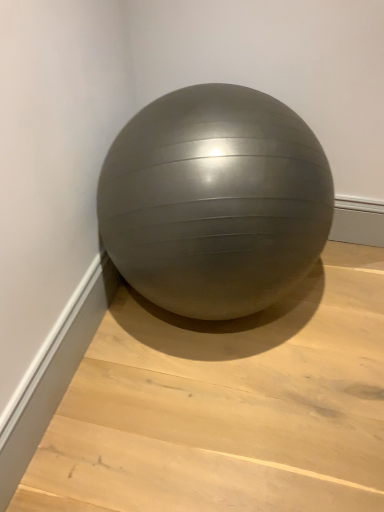
Find the location of a particular element. This screenshot has height=512, width=384. matte gray ball at center is located at coordinates 215,201.

This screenshot has height=512, width=384. What do you see at coordinates (215, 201) in the screenshot?
I see `matte gray ball at center` at bounding box center [215, 201].

Locate an element on the screen. Image resolution: width=384 pixels, height=512 pixels. matte gray ball at center is located at coordinates (215, 201).